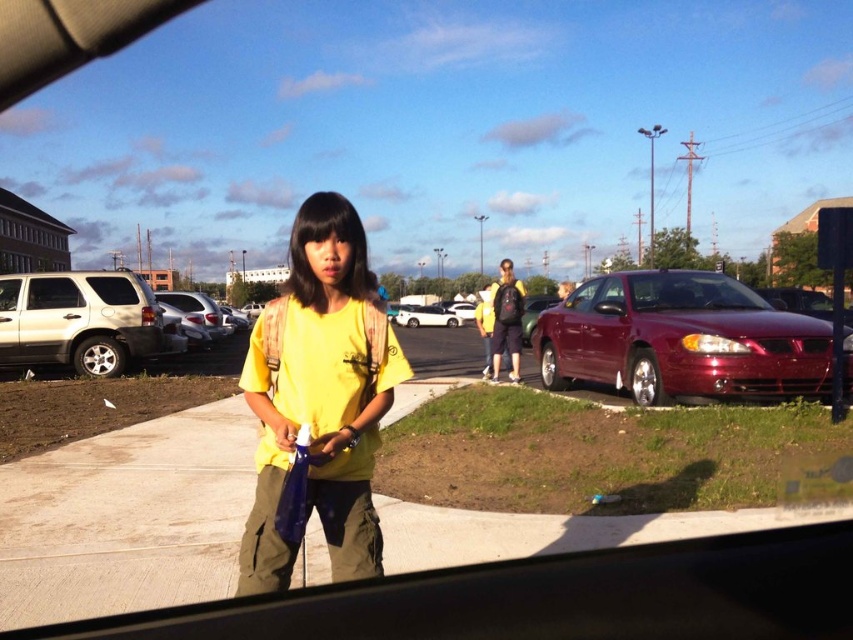
Question: Does glossy red car window at center appear under matte white car window at left?

Choices:
 (A) yes
 (B) no

Answer: (A)

Question: Which of the following is the farthest from the observer?

Choices:
 (A) shiny metallic car at right
 (B) white matte van at center

Answer: (B)

Question: Which point appears farthest from the camera in this image?

Choices:
 (A) (445, 310)
 (B) (708, 291)

Answer: (A)

Question: Is shiny metallic car at right wider than white matte van at center?

Choices:
 (A) yes
 (B) no

Answer: (B)

Question: Can you confirm if matte silver suv at left is wider than matte silver car window at center?

Choices:
 (A) yes
 (B) no

Answer: (A)

Question: Which object is farther from the camera taking this photo?

Choices:
 (A) matte silver suv at left
 (B) matte white car window at left
 (C) matte silver car window at center

Answer: (B)